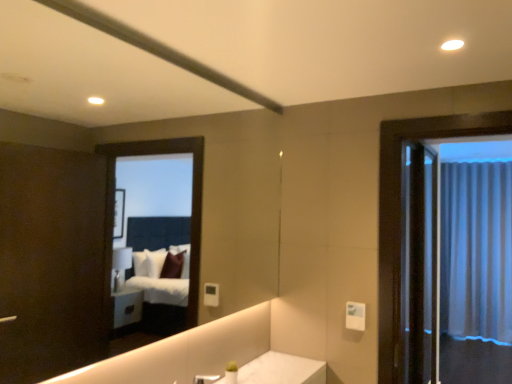
What is the approximate height of silver metallic faucet at lower center?

The height of silver metallic faucet at lower center is 5.10 inches.

This screenshot has width=512, height=384. What do you see at coordinates (205, 379) in the screenshot?
I see `silver metallic faucet at lower center` at bounding box center [205, 379].

The width and height of the screenshot is (512, 384). What do you see at coordinates (423, 264) in the screenshot? I see `clear glass screen door at right` at bounding box center [423, 264].

The width and height of the screenshot is (512, 384). What are the coordinates of `white sheer curtain at right` in the screenshot? It's located at (476, 251).

Does point (420, 192) come behind point (492, 335)?

No, (420, 192) is in front of (492, 335).

Considering the relative positions of clear glass screen door at right and white sheer curtain at right in the image provided, is clear glass screen door at right to the left or to the right of white sheer curtain at right?

clear glass screen door at right is positioned on white sheer curtain at right's left side.

Is clear glass screen door at right bigger or smaller than white sheer curtain at right?

In the image, clear glass screen door at right appears to be smaller than white sheer curtain at right.

How distant is clear glass screen door at right from white sheer curtain at right?

They are 20.13 inches apart.

Is white sheer curtain at right facing away from clear glass screen door at right?

No, white sheer curtain at right is not facing the opposite direction of clear glass screen door at right.

Between point (486, 276) and point (429, 311), which one is positioned behind?

The point (486, 276) is farther from the camera.

From the picture: Would you say white sheer curtain at right is outside clear glass screen door at right?

That's correct, white sheer curtain at right is outside of clear glass screen door at right.

From a real-world perspective, who is located higher, white sheer curtain at right or clear glass screen door at right?

From a 3D spatial view, clear glass screen door at right is above.

Is point (211, 380) behind point (453, 261)?

No.

From the image's perspective, is silver metallic faucet at lower center on white sheer curtain at right?

Indeed, from the image's perspective, silver metallic faucet at lower center is shown above white sheer curtain at right.

At what (x,y) coordinates should I click in order to perform the action: click on faucet on the left of white sheer curtain at right. Please return your answer as a coordinate pair (x, y). The width and height of the screenshot is (512, 384). Looking at the image, I should click on (205, 379).

Is silver metallic faucet at lower center touching white sheer curtain at right?

No, silver metallic faucet at lower center is not touching white sheer curtain at right.

Where is `curtain below the silver metallic faucet at lower center (from the image's perspective)`? The image size is (512, 384). curtain below the silver metallic faucet at lower center (from the image's perspective) is located at coordinates (476, 251).

Is white sheer curtain at right next to silver metallic faucet at lower center?

No, white sheer curtain at right is not making contact with silver metallic faucet at lower center.

From a real-world perspective, is white sheer curtain at right physically below silver metallic faucet at lower center?

No.

Does silver metallic faucet at lower center come behind clear glass screen door at right?

No, the depth of silver metallic faucet at lower center is less than that of clear glass screen door at right.

Is silver metallic faucet at lower center shorter than clear glass screen door at right?

Correct, silver metallic faucet at lower center is not as tall as clear glass screen door at right.

Locate an element on the screen. faucet below the clear glass screen door at right (from the image's perspective) is located at coordinates [x=205, y=379].

In terms of width, does silver metallic faucet at lower center look wider or thinner when compared to clear glass screen door at right?

silver metallic faucet at lower center is thinner than clear glass screen door at right.

Which is behind, point (409, 339) or point (195, 377)?

Positioned behind is point (409, 339).

Which object is positioned more to the right, clear glass screen door at right or silver metallic faucet at lower center?

From the viewer's perspective, clear glass screen door at right appears more on the right side.

Is silver metallic faucet at lower center at the back of clear glass screen door at right?

clear glass screen door at right does not have its back to silver metallic faucet at lower center.

Can you tell me how much clear glass screen door at right and silver metallic faucet at lower center differ in facing direction?

2.22 degrees.

You are a GUI agent. You are given a task and a screenshot of the screen. Output one action in this format:
    pyautogui.click(x=<x>, y=<y>)
    Task: Click on the screen door that is on the left side of white sheer curtain at right
    The width and height of the screenshot is (512, 384).
    Given the screenshot: What is the action you would take?
    pyautogui.click(x=423, y=264)

This screenshot has height=384, width=512. What are the coordinates of `screen door in front of the white sheer curtain at right` in the screenshot? It's located at (423, 264).

Considering their positions, is silver metallic faucet at lower center positioned closer to clear glass screen door at right than white sheer curtain at right?

Among the two, white sheer curtain at right is located nearer to clear glass screen door at right.

When comparing their distances from silver metallic faucet at lower center, does white sheer curtain at right or clear glass screen door at right seem further?

white sheer curtain at right lies further to silver metallic faucet at lower center than the other object.

Based on their spatial positions, is clear glass screen door at right or white sheer curtain at right further from silver metallic faucet at lower center?

Based on the image, white sheer curtain at right appears to be further to silver metallic faucet at lower center.

From the image, which object appears to be nearer to white sheer curtain at right, clear glass screen door at right or silver metallic faucet at lower center?

clear glass screen door at right is closer to white sheer curtain at right.

From the image, which object appears to be nearer to clear glass screen door at right, white sheer curtain at right or silver metallic faucet at lower center?

white sheer curtain at right is positioned closer to the anchor clear glass screen door at right.

From the image, which object appears to be nearer to white sheer curtain at right, silver metallic faucet at lower center or clear glass screen door at right?

clear glass screen door at right.

Locate an element on the screen. The image size is (512, 384). screen door located between silver metallic faucet at lower center and white sheer curtain at right in the depth direction is located at coordinates (423, 264).